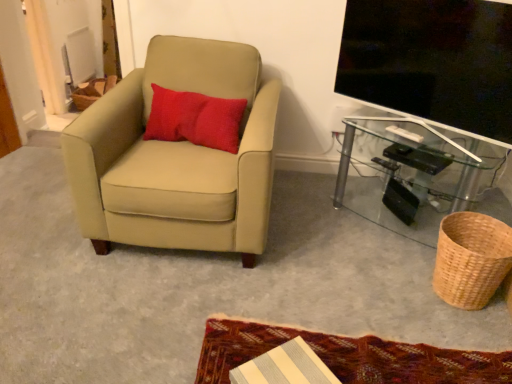
At what (x,y) coordinates should I click in order to perform the action: click on free point in front of woven natural basket at lower right. Please return your answer as a coordinate pair (x, y). Looking at the image, I should click on (466, 326).